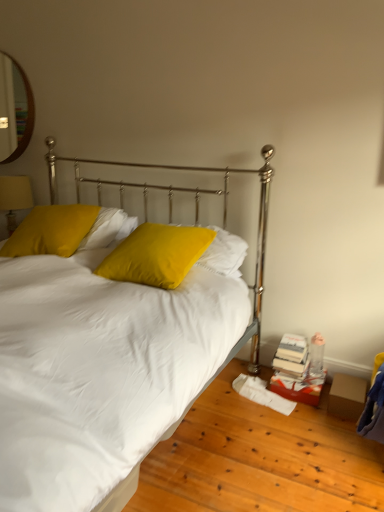
Question: Is wooden framed mirror at upper left positioned far away from white satin bed at center?

Choices:
 (A) no
 (B) yes

Answer: (B)

Question: Is wooden framed mirror at upper left located outside white satin bed at center?

Choices:
 (A) no
 (B) yes

Answer: (B)

Question: Could white satin bed at center be considered to be inside wooden framed mirror at upper left?

Choices:
 (A) yes
 (B) no

Answer: (B)

Question: From a real-world perspective, is wooden framed mirror at upper left positioned under white satin bed at center based on gravity?

Choices:
 (A) yes
 (B) no

Answer: (B)

Question: Can you confirm if wooden framed mirror at upper left is bigger than white satin bed at center?

Choices:
 (A) yes
 (B) no

Answer: (B)

Question: Considering the positions of point (254, 267) and point (1, 73), is point (254, 267) closer or farther from the camera than point (1, 73)?

Choices:
 (A) farther
 (B) closer

Answer: (B)

Question: From their relative heights in the image, would you say white satin bed at center is taller or shorter than wooden framed mirror at upper left?

Choices:
 (A) short
 (B) tall

Answer: (B)

Question: From a real-world perspective, relative to wooden framed mirror at upper left, is white satin bed at center vertically above or below?

Choices:
 (A) above
 (B) below

Answer: (B)

Question: Based on their sizes in the image, would you say white satin bed at center is bigger or smaller than wooden framed mirror at upper left?

Choices:
 (A) small
 (B) big

Answer: (B)

Question: Based on their sizes in the image, would you say matte yellow fabric at left is bigger or smaller than matte yellow pillow at upper left, positioned as the 1th pillow in left-to-right order?

Choices:
 (A) small
 (B) big

Answer: (A)

Question: Considering the positions of matte yellow fabric at left and matte yellow pillow at upper left, the second pillow in the right-to-left sequence, in the image, is matte yellow fabric at left taller or shorter than matte yellow pillow at upper left, the second pillow in the right-to-left sequence,?

Choices:
 (A) short
 (B) tall

Answer: (B)

Question: Considering the positions of matte yellow fabric at left and matte yellow pillow at upper left, positioned as the 1th pillow in left-to-right order, in the image, is matte yellow fabric at left wider or thinner than matte yellow pillow at upper left, positioned as the 1th pillow in left-to-right order,?

Choices:
 (A) thin
 (B) wide

Answer: (A)

Question: Would you say matte yellow fabric at left is to the left or to the right of matte yellow pillow at upper left, the second pillow in the right-to-left sequence, in the picture?

Choices:
 (A) left
 (B) right

Answer: (A)

Question: In terms of width, does matte yellow pillow at upper left, the second pillow in the right-to-left sequence, look wider or thinner when compared to matte yellow fabric at left?

Choices:
 (A) thin
 (B) wide

Answer: (B)

Question: Is point (8, 239) closer or farther from the camera than point (18, 182)?

Choices:
 (A) farther
 (B) closer

Answer: (B)